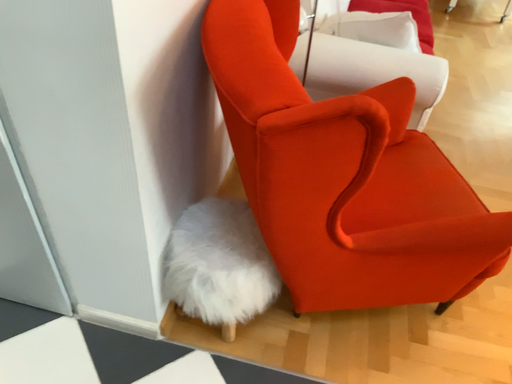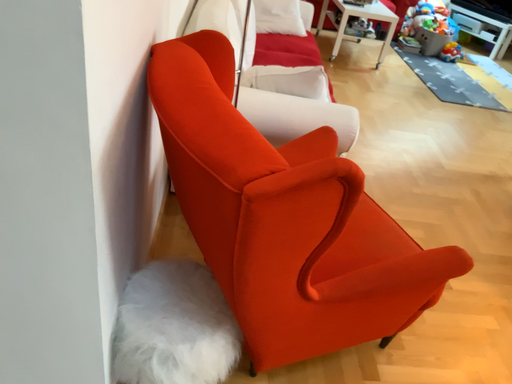
Question: Which way did the camera rotate in the video?

Choices:
 (A) rotated right
 (B) rotated left

Answer: (A)